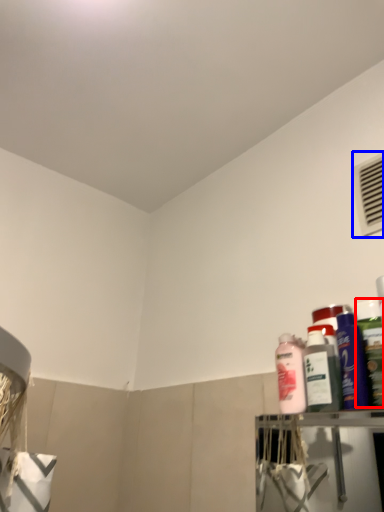
Question: Which object appears farthest to the camera in this image, cleaning product (highlighted by a red box) or air conditioning (highlighted by a blue box)?

Choices:
 (A) cleaning product
 (B) air conditioning

Answer: (B)